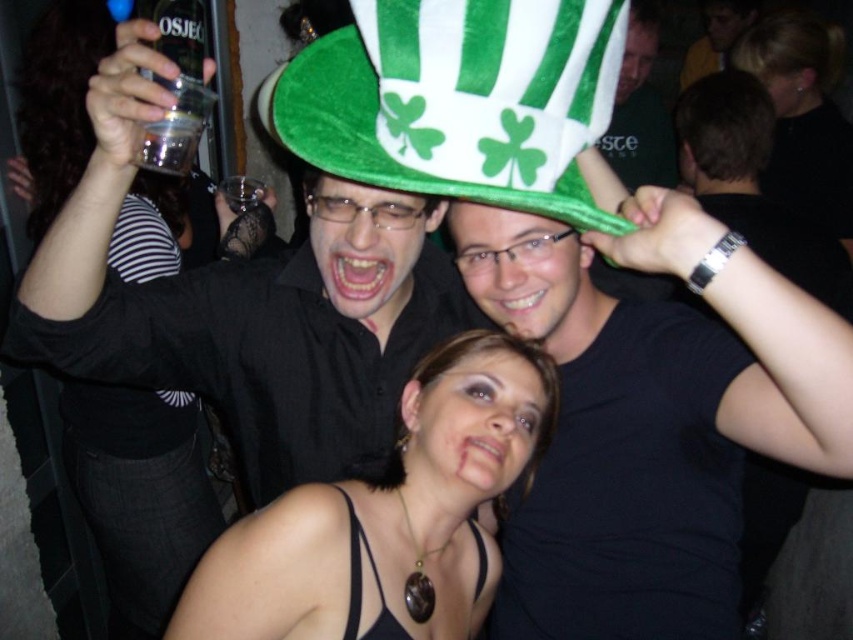
Looking at this image, you are at a party and want to take a photo of the black matte shirt at center and the velvet green hat at center. Your camera has a minimum focus distance of 20 centimeters. Can you focus on both objects simultaneously?

The black matte shirt at center is 20.40 centimeters away from the velvet green hat at center, so yes, the camera can focus on both objects since the distance between them is slightly over the minimum focus requirement.

You are a photographer standing 1.5 meters away from the camera. You want to take a photo of the black matte shirt at upper center. Can you reach it without moving the camera?

The black matte shirt at upper center is 2.71 meters away from the camera. Since you are standing 1.5 meters away from the camera, the total distance between you and the black matte shirt at upper center would be 1.5 meters plus 2.71 meters, totaling 4.21 meters. This distance is likely too far to reach the black matte shirt at upper center without moving the camera.